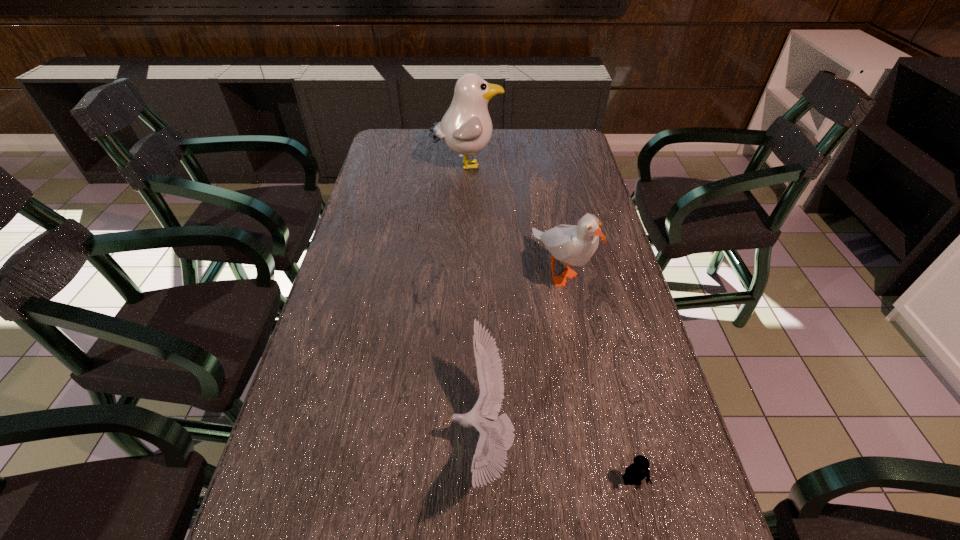
Identify the location of gull that is the closest to the shortest object. (497, 435).

Choose which gull is the second nearest neighbor to the tallest gull. Please provide its 2D coordinates. Your answer should be formatted as a tuple, i.e. [(x, y)], where the tuple contains the x and y coordinates of a point satisfying the conditions above.

[(497, 435)]

This screenshot has height=540, width=960. In order to click on vacant point that satisfies the following two spatial constraints: 1. at the beak of the second farthest gull; 2. at the tip of the beak of the second shortest object in this screenshot , I will do `click(590, 437)`.